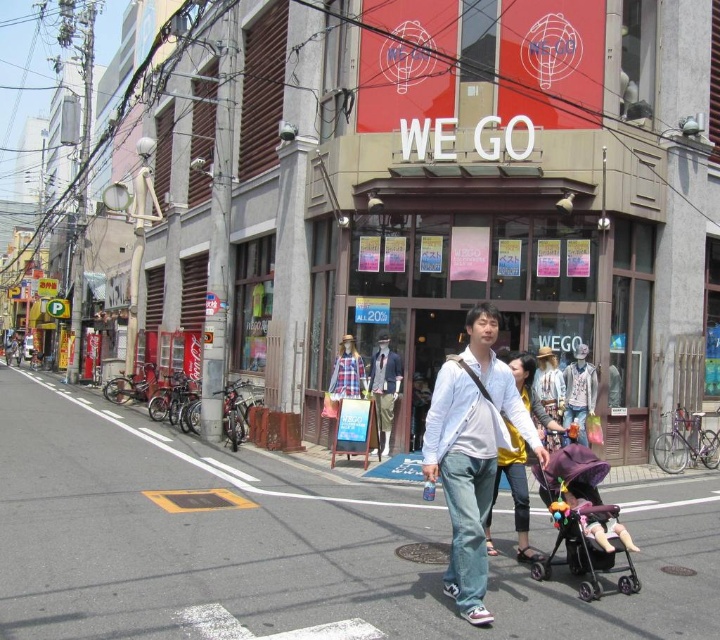
Can you confirm if light purple fabric stroller at lower center is taller than matte purple dress at center?

No.

Can you confirm if light purple fabric stroller at lower center is thinner than matte purple dress at center?

Correct, light purple fabric stroller at lower center's width is less than matte purple dress at center's.

Who is more forward, (600, 531) or (558, 371)?

Point (600, 531) is in front.

The width and height of the screenshot is (720, 640). What are the coordinates of `light purple fabric stroller at lower center` in the screenshot? It's located at (606, 531).

Can you confirm if black plastic baby carriage at lower right is thinner than denim jacket at center?

No.

At what (x,y) coordinates should I click in order to perform the action: click on black plastic baby carriage at lower right. Please return your answer as a coordinate pair (x, y). This screenshot has height=640, width=720. Looking at the image, I should click on (582, 522).

At what (x,y) coordinates should I click in order to perform the action: click on black plastic baby carriage at lower right. Please return your answer as a coordinate pair (x, y). Looking at the image, I should click on coord(582,522).

Locate an element on the screen. The width and height of the screenshot is (720, 640). light yellow fabric dress at center is located at coordinates (513, 496).

Based on the photo, who is lower down, light yellow fabric dress at center or matte purple dress at center?

light yellow fabric dress at center

Is point (498, 472) less distant than point (558, 438)?

That is True.

You are a GUI agent. You are given a task and a screenshot of the screen. Output one action in this format:
    pyautogui.click(x=<x>, y=<y>)
    Task: Click on the light yellow fabric dress at center
    
    Given the screenshot: What is the action you would take?
    pyautogui.click(x=513, y=496)